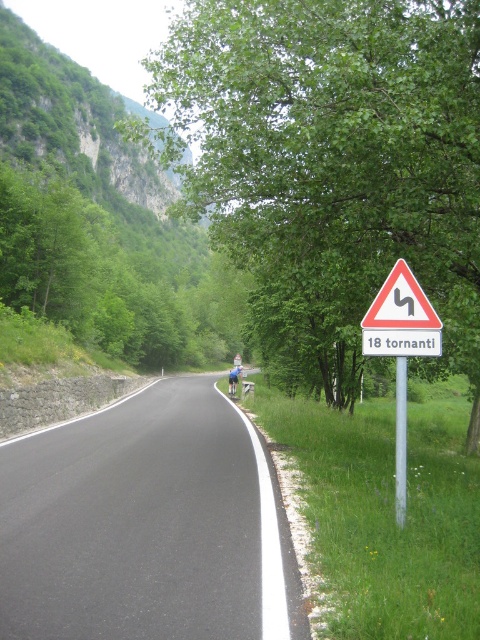
You are driving a car and need to stay on the black asphalt road at center. There is a white triangular sign with black curved arrow at right ahead. Can you see the road before the sign?

The black asphalt road at center is shorter than the white triangular sign with black curved arrow at right, so you cannot see the road before the sign because the sign is taller and blocks the view.